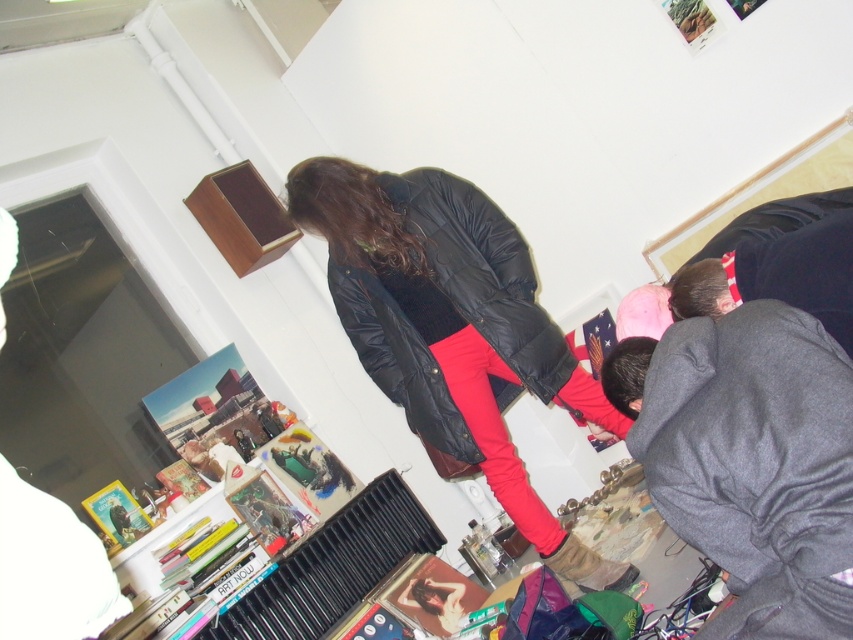
Question: Among these points, which one is farthest from the camera?

Choices:
 (A) (737, 429)
 (B) (456, 224)

Answer: (B)

Question: Is matte black jacket at center behind black matte sweatshirt at center?

Choices:
 (A) no
 (B) yes

Answer: (A)

Question: Which of the following is the farthest from the observer?

Choices:
 (A) (793, 522)
 (B) (445, 417)

Answer: (B)

Question: Does gray fleece sweatshirt at lower right come behind black matte sweatshirt at center?

Choices:
 (A) yes
 (B) no

Answer: (B)

Question: Is matte black jacket at center bigger than gray fleece sweatshirt at lower right?

Choices:
 (A) yes
 (B) no

Answer: (A)

Question: Which point is closer to the camera taking this photo?

Choices:
 (A) (498, 321)
 (B) (492, 388)
 (C) (815, 582)

Answer: (C)